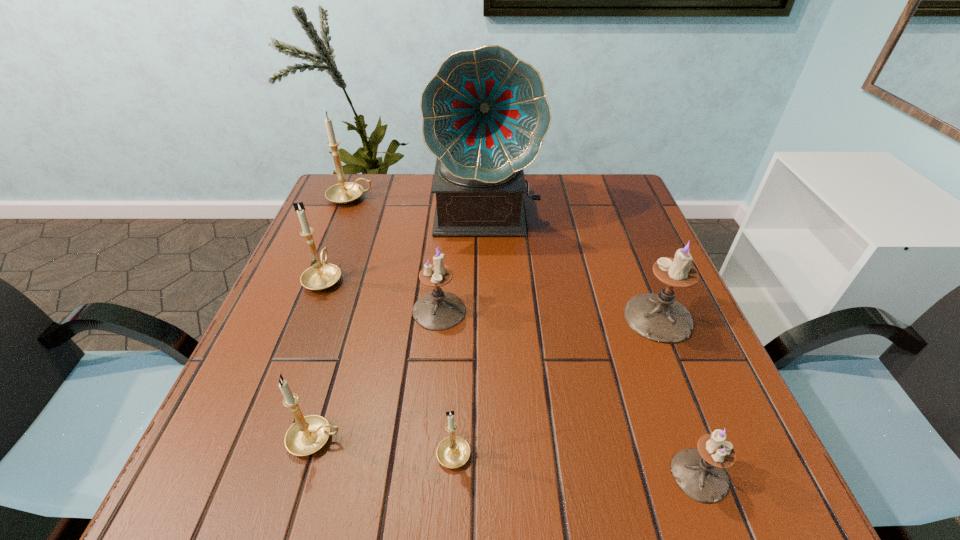
Locate an element on the screen. The image size is (960, 540). vacant space located 0.180m on the handle side of the farthest candle holder is located at coordinates (438, 198).

Find the location of a particular element. free space located on the handle side of the second biggest gold candle holder is located at coordinates (356, 195).

Where is `vacant space situated on the handle side of the second biggest gold candle holder`? This screenshot has width=960, height=540. vacant space situated on the handle side of the second biggest gold candle holder is located at coordinates (339, 239).

Where is `vacant space located on the handle side of the second biggest gold candle holder`? This screenshot has height=540, width=960. vacant space located on the handle side of the second biggest gold candle holder is located at coordinates (360, 186).

The height and width of the screenshot is (540, 960). Find the location of `free spot located 0.050m on the front of the biggest purple candle holder`. free spot located 0.050m on the front of the biggest purple candle holder is located at coordinates (678, 365).

Locate an element on the screen. The width and height of the screenshot is (960, 540). vacant space located 0.270m on the back of the second smallest purple candle holder is located at coordinates (447, 222).

Find the location of a particular element. The width and height of the screenshot is (960, 540). vacant region located on the handle side of the third biggest gold candle holder is located at coordinates (528, 439).

Where is `vacant area situated on the handle side of the smallest gold candle holder`? vacant area situated on the handle side of the smallest gold candle holder is located at coordinates coord(459,341).

Locate an element on the screen. The width and height of the screenshot is (960, 540). free spot located on the handle side of the smallest gold candle holder is located at coordinates (461, 299).

Locate an element on the screen. This screenshot has width=960, height=540. vacant space located 0.060m on the handle side of the smallest gold candle holder is located at coordinates (456, 399).